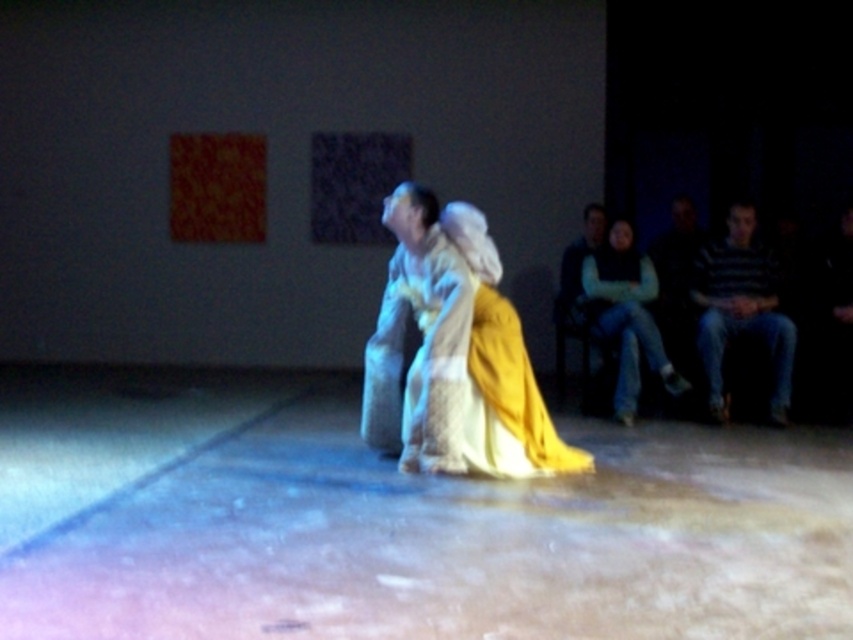
You are a photographer trying to capture the interaction between the two main figures. You notice the matte white dress at center and the light green sweater at right. Based on their positions, which one is closer to the left edge of the frame?

The matte white dress at center is positioned on the left side of light green sweater at right, so the matte white dress at center is closer to the left edge of the frame.

You are a photographer trying to capture the scene. You notice two points in the image at coordinates point (772, 371) and point (624, 378). Which point is closer to the camera?

Point (772, 371) is further to the camera than point (624, 378), so the closer point to the camera is point (624, 378).

You are a photographer setting up a camera to capture the scene. The matte white dress at center and the light green sweater at right are both in the frame. Based on their positions, which object might have a larger width in the photo?

The matte white dress at center might be wider than the light green sweater at right, so it would likely appear larger in width in the photograph.